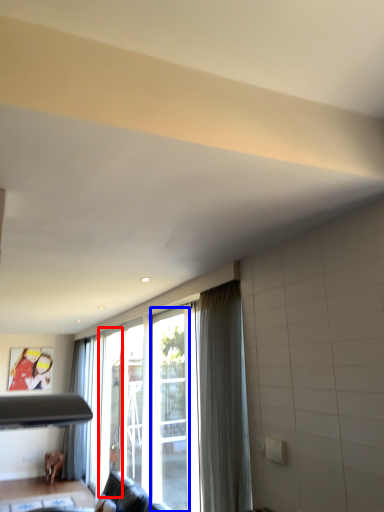
Question: Which object is closer to the camera taking this photo, screen door (highlighted by a red box) or screen door (highlighted by a blue box)?

Choices:
 (A) screen door
 (B) screen door

Answer: (B)